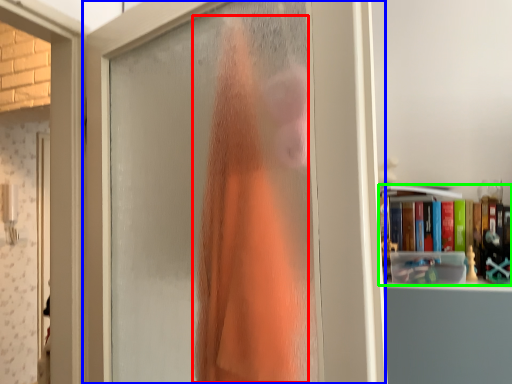
Question: Considering the real-world distances, which object is farthest from clothing (highlighted by a red box)? door (highlighted by a blue box) or book (highlighted by a green box)?

Choices:
 (A) door
 (B) book

Answer: (B)